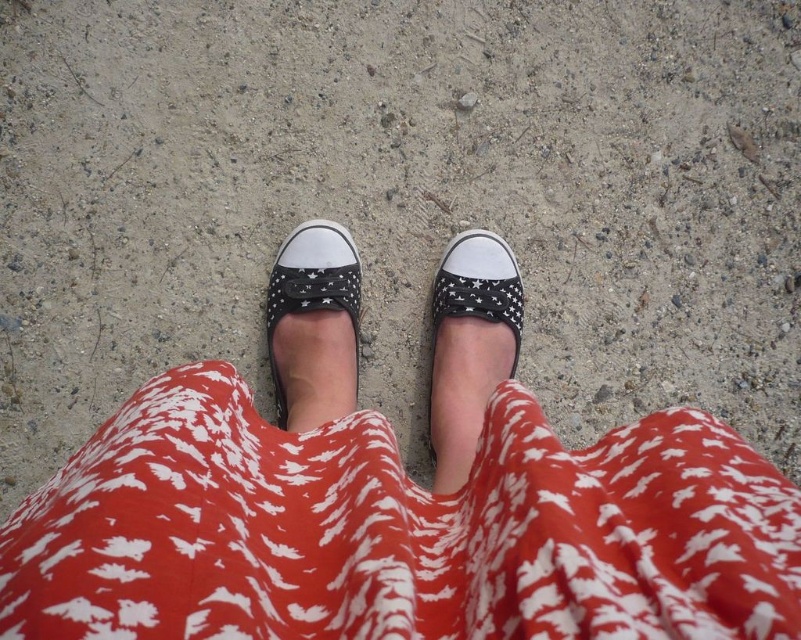
You are a photographer trying to capture the texture of the ground. You notice two points on the image at coordinates point (206, 412) and point (437, 465). Which point should you focus on to get a clearer view of the ground texture?

Point (206, 412) is closer to the viewer than point (437, 465), so focusing on point (206, 412) would provide a clearer view of the ground texture.